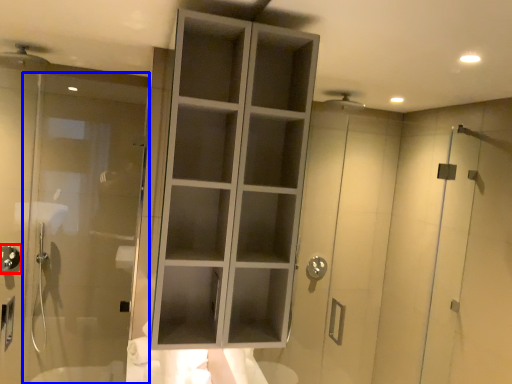
Question: Which object is further to the camera taking this photo, shower (highlighted by a red box) or door (highlighted by a blue box)?

Choices:
 (A) shower
 (B) door

Answer: (A)